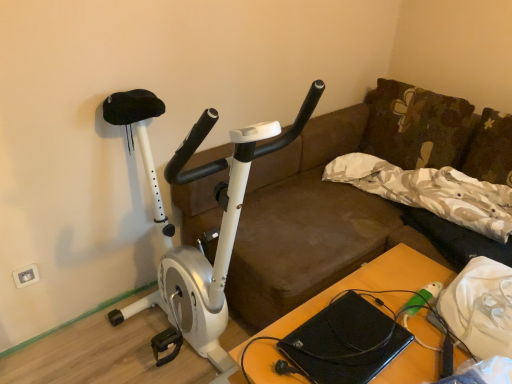
This screenshot has height=384, width=512. Find the location of `white matte stationary bicycle at left`. white matte stationary bicycle at left is located at coordinates [215, 233].

This screenshot has height=384, width=512. What do you see at coordinates (362, 287) in the screenshot?
I see `wooden table at center` at bounding box center [362, 287].

Measure the distance between point (362, 287) and camera.

Point (362, 287) and camera are 1.56 meters apart.

Where is `floral fabric pillow at upper right, which is the first pillow in top-to-bottom order`? The height and width of the screenshot is (384, 512). floral fabric pillow at upper right, which is the first pillow in top-to-bottom order is located at coordinates (416, 126).

What do you see at coordinates (345, 342) in the screenshot?
I see `black matte laptop at lower center` at bounding box center [345, 342].

In order to face beige floral fabric pillow at upper right, the first pillow positioned from the bottom, should I rotate leftwards or rightwards?

Rotate your view right by about 21.305°.

The width and height of the screenshot is (512, 384). Identify the location of white matte stationary bicycle at left. (215, 233).

Can you tell me how much white plastic electric outlet at lower left and black matte laptop at lower center differ in facing direction?

white plastic electric outlet at lower left and black matte laptop at lower center are facing 0.887 degrees away from each other.

From a real-world perspective, is white plastic electric outlet at lower left beneath black matte laptop at lower center?

Yes, from a real-world perspective, white plastic electric outlet at lower left is below black matte laptop at lower center.

At what (x,y) coordinates should I click in order to perform the action: click on electric outlet that is behind the black matte laptop at lower center. Please return your answer as a coordinate pair (x, y). The image size is (512, 384). Looking at the image, I should click on (26, 275).

Which point is more distant from viewer, (23, 269) or (340, 352)?

The point (23, 269) is more distant.

Is point (212, 353) behind point (413, 354)?

Yes, point (212, 353) is behind point (413, 354).

Considering the sizes of objects white matte stationary bicycle at left and wooden table at center in the image provided, who is bigger, white matte stationary bicycle at left or wooden table at center?

With larger size is white matte stationary bicycle at left.

Can you see white matte stationary bicycle at left touching wooden table at center?

No, white matte stationary bicycle at left is not with wooden table at center.

Is white matte stationary bicycle at left oriented away from wooden table at center?

No, wooden table at center is not at the back of white matte stationary bicycle at left.

From a real-world perspective, who is located higher, wooden table at center or beige floral fabric pillow at upper right, placed as the 2th pillow when sorted from top to bottom?

From a 3D spatial view, beige floral fabric pillow at upper right, placed as the 2th pillow when sorted from top to bottom, is above.

Is wooden table at center wider than beige floral fabric pillow at upper right, the first pillow positioned from the bottom?

Yes.

Is wooden table at center touching beige floral fabric pillow at upper right, the first pillow positioned from the bottom?

No, wooden table at center is not making contact with beige floral fabric pillow at upper right, the first pillow positioned from the bottom.

Between wooden table at center and beige floral fabric pillow at upper right, the first pillow positioned from the bottom, which one appears on the left side from the viewer's perspective?

Positioned to the left is wooden table at center.

From a real-world perspective, is wooden table at center on floral fabric pillow at upper right, placed as the 2th pillow when sorted from bottom to top?

No, from a real-world perspective, wooden table at center is not above floral fabric pillow at upper right, placed as the 2th pillow when sorted from bottom to top.

Locate an element on the screen. table below the floral fabric pillow at upper right, which is the first pillow in top-to-bottom order (from a real-world perspective) is located at coordinates (362, 287).

How many degrees apart are the facing directions of wooden table at center and floral fabric pillow at upper right, placed as the 2th pillow when sorted from bottom to top?

The angular difference between wooden table at center and floral fabric pillow at upper right, placed as the 2th pillow when sorted from bottom to top, is 8.95 degrees.

Is wooden table at center oriented towards floral fabric pillow at upper right, placed as the 2th pillow when sorted from bottom to top?

No, wooden table at center is not oriented towards floral fabric pillow at upper right, placed as the 2th pillow when sorted from bottom to top.

Considering the positions of objects floral fabric pillow at upper right, placed as the 2th pillow when sorted from bottom to top, and white plastic electric outlet at lower left in the image provided, who is in front, floral fabric pillow at upper right, placed as the 2th pillow when sorted from bottom to top, or white plastic electric outlet at lower left?

Positioned in front is white plastic electric outlet at lower left.

Is floral fabric pillow at upper right, placed as the 2th pillow when sorted from bottom to top, oriented away from white plastic electric outlet at lower left?

floral fabric pillow at upper right, placed as the 2th pillow when sorted from bottom to top, does not have its back to white plastic electric outlet at lower left.

Which object is wider, floral fabric pillow at upper right, which is the first pillow in top-to-bottom order, or white plastic electric outlet at lower left?

floral fabric pillow at upper right, which is the first pillow in top-to-bottom order.

Considering the sizes of objects floral fabric pillow at upper right, placed as the 2th pillow when sorted from bottom to top, and white plastic electric outlet at lower left in the image provided, who is bigger, floral fabric pillow at upper right, placed as the 2th pillow when sorted from bottom to top, or white plastic electric outlet at lower left?

floral fabric pillow at upper right, placed as the 2th pillow when sorted from bottom to top, is bigger.

In the scene shown: From a real-world perspective, is floral fabric pillow at upper right, which is the first pillow in top-to-bottom order, positioned above or below wooden table at center?

From a real-world perspective, floral fabric pillow at upper right, which is the first pillow in top-to-bottom order, is physically above wooden table at center.

From the image's perspective, between floral fabric pillow at upper right, which is the first pillow in top-to-bottom order, and wooden table at center, which one is located above?

floral fabric pillow at upper right, which is the first pillow in top-to-bottom order, appears higher in the image.

Between floral fabric pillow at upper right, which is the first pillow in top-to-bottom order, and wooden table at center, which one is positioned in front?

wooden table at center is closer to the camera.

Are floral fabric pillow at upper right, placed as the 2th pillow when sorted from bottom to top, and wooden table at center making contact?

They are not placed beside each other.

From the image's perspective, is wooden table at center above or below white plastic electric outlet at lower left?

Based on their image positions, wooden table at center is located beneath white plastic electric outlet at lower left.

Does point (300, 377) come in front of point (27, 276)?

Yes.

Does wooden table at center have a smaller size compared to white plastic electric outlet at lower left?

No, wooden table at center is not smaller than white plastic electric outlet at lower left.

Locate an element on the screen. laptop that appears on the right of white plastic electric outlet at lower left is located at coordinates (345, 342).

You are a GUI agent. You are given a task and a screenshot of the screen. Output one action in this format:
    pyautogui.click(x=<x>, y=<y>)
    Task: Click on the table behind the white matte stationary bicycle at left
    The width and height of the screenshot is (512, 384).
    Given the screenshot: What is the action you would take?
    pyautogui.click(x=362, y=287)

Based on their spatial positions, is floral fabric pillow at upper right, which is the first pillow in top-to-bottom order, or black matte laptop at lower center closer to white plastic electric outlet at lower left?

black matte laptop at lower center lies closer to white plastic electric outlet at lower left than the other object.

Which object lies further to the anchor point white matte stationary bicycle at left, wooden table at center or black matte laptop at lower center?

Based on the image, wooden table at center appears to be further to white matte stationary bicycle at left.

Estimate the real-world distances between objects in this image. Which object is further from wooden table at center, white matte stationary bicycle at left or white plastic electric outlet at lower left?

white plastic electric outlet at lower left lies further to wooden table at center than the other object.

Estimate the real-world distances between objects in this image. Which object is closer to white matte stationary bicycle at left, wooden table at center or white plastic electric outlet at lower left?

wooden table at center.

Which object lies further to the anchor point black matte laptop at lower center, white plastic electric outlet at lower left or floral fabric pillow at upper right, placed as the 2th pillow when sorted from bottom to top?

white plastic electric outlet at lower left.

Looking at the image, which one is located closer to wooden table at center, white matte stationary bicycle at left or beige floral fabric pillow at upper right, the first pillow positioned from the bottom?

beige floral fabric pillow at upper right, the first pillow positioned from the bottom.

Estimate the real-world distances between objects in this image. Which object is closer to white matte stationary bicycle at left, white plastic electric outlet at lower left or floral fabric pillow at upper right, which is the first pillow in top-to-bottom order?

white plastic electric outlet at lower left lies closer to white matte stationary bicycle at left than the other object.

Looking at the image, which one is located further to floral fabric pillow at upper right, which is the first pillow in top-to-bottom order, beige floral fabric pillow at upper right, the first pillow positioned from the bottom, or white matte stationary bicycle at left?

Among the two, white matte stationary bicycle at left is located further to floral fabric pillow at upper right, which is the first pillow in top-to-bottom order.

Where is `laptop between floral fabric pillow at upper right, placed as the 2th pillow when sorted from bottom to top, and wooden table at center in the up-down direction`? The width and height of the screenshot is (512, 384). laptop between floral fabric pillow at upper right, placed as the 2th pillow when sorted from bottom to top, and wooden table at center in the up-down direction is located at coordinates (345, 342).

Locate an element on the screen. table between white matte stationary bicycle at left and floral fabric pillow at upper right, placed as the 2th pillow when sorted from bottom to top, in the front-back direction is located at coordinates (362, 287).

The height and width of the screenshot is (384, 512). Find the location of `laptop between white plastic electric outlet at lower left and wooden table at center from left to right`. laptop between white plastic electric outlet at lower left and wooden table at center from left to right is located at coordinates (345, 342).

At what (x,y) coordinates should I click in order to perform the action: click on table between white plastic electric outlet at lower left and floral fabric pillow at upper right, which is the first pillow in top-to-bottom order, in the horizontal direction. Please return your answer as a coordinate pair (x, y). The height and width of the screenshot is (384, 512). Looking at the image, I should click on (362, 287).